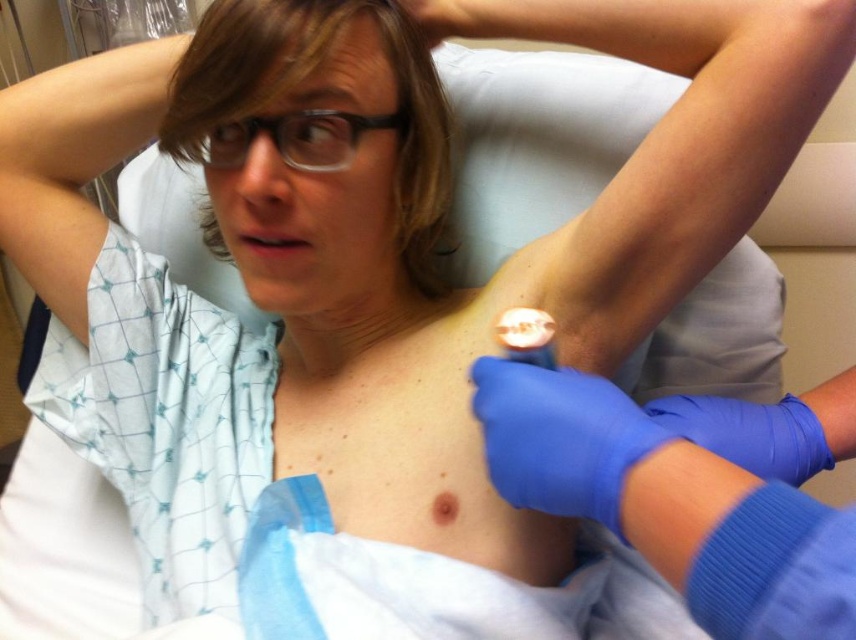
Question: Which point is closer to the camera?

Choices:
 (A) blue rubber glove at center
 (B) matte black hair at upper center
 (C) blue latex glove at upper center
 (D) blue latex glove at upper right

Answer: (A)

Question: Is blue rubber glove at upper right to the left of blue latex glove at upper right from the viewer's perspective?

Choices:
 (A) yes
 (B) no

Answer: (A)

Question: Which point appears closest to the camera in this image?

Choices:
 (A) (574, 486)
 (B) (791, 404)

Answer: (A)

Question: Is blue rubber glove at upper right above matte black hair at upper center?

Choices:
 (A) no
 (B) yes

Answer: (A)

Question: Is blue rubber glove at upper right below blue latex glove at upper center?

Choices:
 (A) no
 (B) yes

Answer: (B)

Question: Which point is closer to the camera?

Choices:
 (A) blue latex glove at upper center
 (B) blue latex glove at upper right
 (C) blue rubber glove at upper right

Answer: (C)